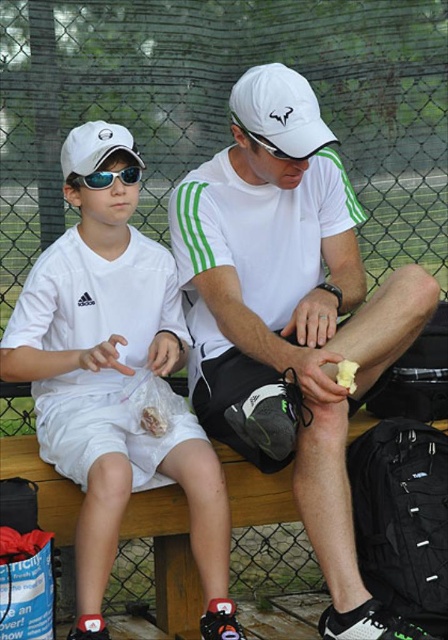
Does white matte tennis shoe at lower center have a lesser width compared to white matte baseball cap at upper left?

No.

Between point (332, 500) and point (73, 150), which one is positioned in front?

Point (332, 500)

The image size is (448, 640). Identify the location of white matte tennis shoe at lower center. (292, 310).

I want to click on white matte tennis shoe at lower center, so click(x=292, y=310).

Is white matte tennis outfit at center in front of white matte baseball cap at upper left?

Yes.

Does white matte tennis outfit at center have a greater height compared to white matte baseball cap at upper left?

Yes, white matte tennis outfit at center is taller than white matte baseball cap at upper left.

Between point (163, 458) and point (63, 148), which one is positioned behind?

Positioned behind is point (63, 148).

This screenshot has width=448, height=640. I want to click on white matte tennis outfit at center, so [x=116, y=394].

Can you confirm if white matte tennis shoe at lower center is positioned below yellow butter at lower right?

No.

Does white matte tennis shoe at lower center come behind yellow butter at lower right?

No, white matte tennis shoe at lower center is in front of yellow butter at lower right.

Identify the location of white matte tennis shoe at lower center. Image resolution: width=448 pixels, height=640 pixels. (292, 310).

Locate an element on the screen. The width and height of the screenshot is (448, 640). white matte tennis shoe at lower center is located at coordinates (292, 310).